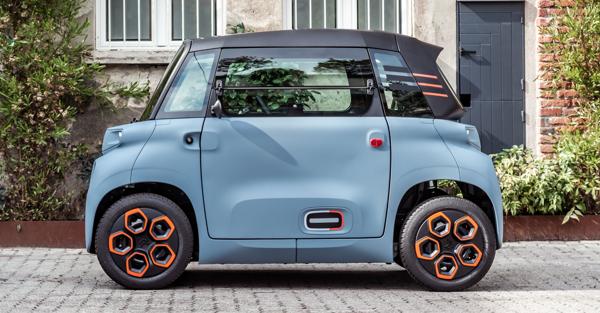
Identify the location of door. This screenshot has width=600, height=313. (494, 81).